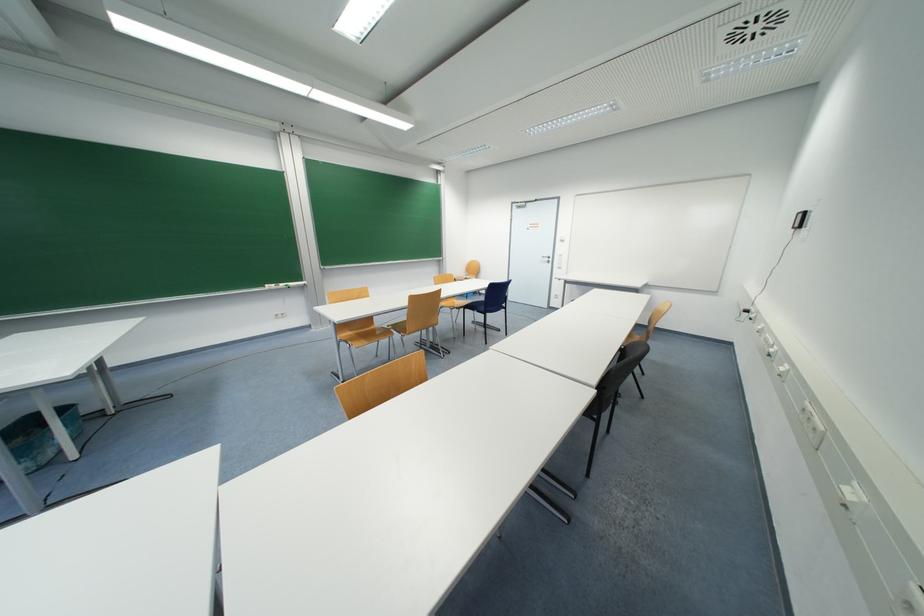
At what (x,y) coordinates should I click in order to perform the action: click on silver door handle. Please return your answer as a coordinate pair (x, y). Looking at the image, I should click on (545, 257).